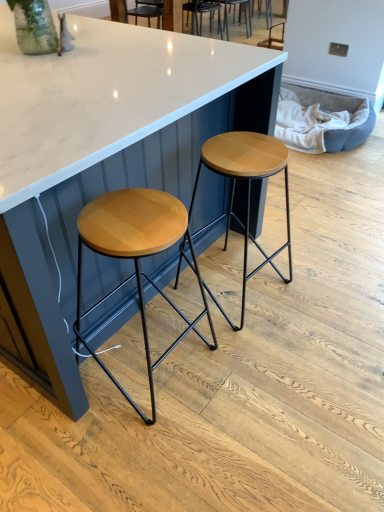
Question: Is woodenmaterial/texturestool at left, which appears as the 2th stool when viewed from the right, to the right of white glossy table at center from the viewer's perspective?

Choices:
 (A) yes
 (B) no

Answer: (A)

Question: Can you confirm if woodenmaterial/texturestool at left, arranged as the first stool when viewed from the left, is taller than white glossy table at center?

Choices:
 (A) yes
 (B) no

Answer: (B)

Question: Does woodenmaterial/texturestool at left, which appears as the 2th stool when viewed from the right, turn towards white glossy table at center?

Choices:
 (A) yes
 (B) no

Answer: (A)

Question: Does woodenmaterial/texturestool at left, arranged as the first stool when viewed from the left, have a larger size compared to white glossy table at center?

Choices:
 (A) yes
 (B) no

Answer: (B)

Question: Is woodenmaterial/texturestool at left, arranged as the first stool when viewed from the left, positioned in front of white glossy table at center?

Choices:
 (A) no
 (B) yes

Answer: (A)

Question: Is woodenmaterial/texturestool at left, which appears as the 2th stool when viewed from the right, looking in the opposite direction of white glossy table at center?

Choices:
 (A) yes
 (B) no

Answer: (B)

Question: Does woodenmaterial/texturestool at left, arranged as the first stool when viewed from the left, appear on the right side of wooden matte stool at center, the first stool viewed from the right?

Choices:
 (A) no
 (B) yes

Answer: (A)

Question: Is woodenmaterial/texturestool at left, arranged as the first stool when viewed from the left, positioned before wooden matte stool at center, the first stool viewed from the right?

Choices:
 (A) yes
 (B) no

Answer: (A)

Question: Is woodenmaterial/texturestool at left, which appears as the 2th stool when viewed from the right, beside wooden matte stool at center, the first stool viewed from the right?

Choices:
 (A) yes
 (B) no

Answer: (B)

Question: Is woodenmaterial/texturestool at left, arranged as the first stool when viewed from the left, oriented towards wooden matte stool at center, which is the 2th stool in left-to-right order?

Choices:
 (A) yes
 (B) no

Answer: (B)

Question: From the image's perspective, is woodenmaterial/texturestool at left, arranged as the first stool when viewed from the left, located above wooden matte stool at center, the first stool viewed from the right?

Choices:
 (A) no
 (B) yes

Answer: (A)

Question: Is woodenmaterial/texturestool at left, arranged as the first stool when viewed from the left, to the left of wooden matte stool at center, which is the 2th stool in left-to-right order, from the viewer's perspective?

Choices:
 (A) yes
 (B) no

Answer: (A)

Question: Does white glossy table at center have a larger size compared to woodenmaterial/texturestool at left, which appears as the 2th stool when viewed from the right?

Choices:
 (A) yes
 (B) no

Answer: (A)